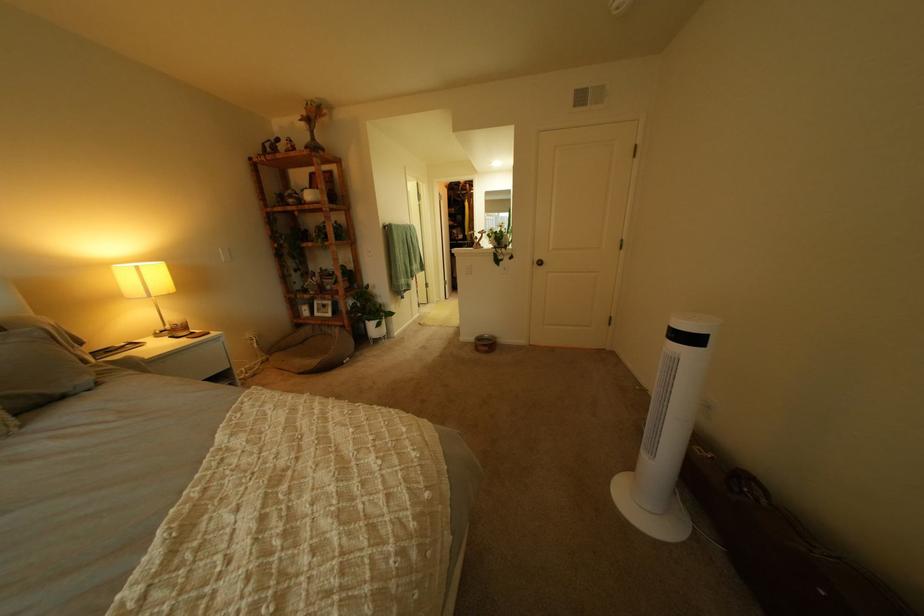
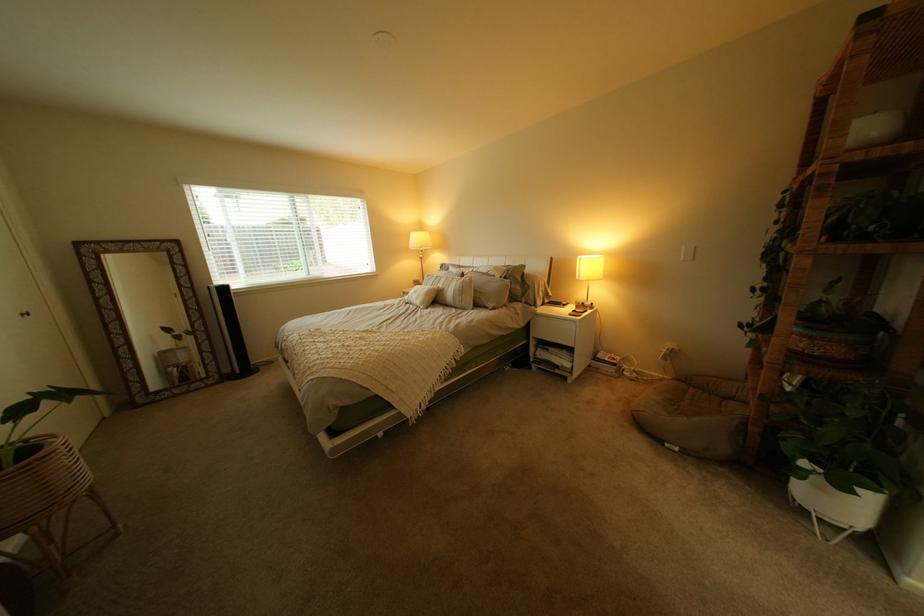
Where in the second image is the point corresponding to point 392,342 from the first image?

(821, 512)